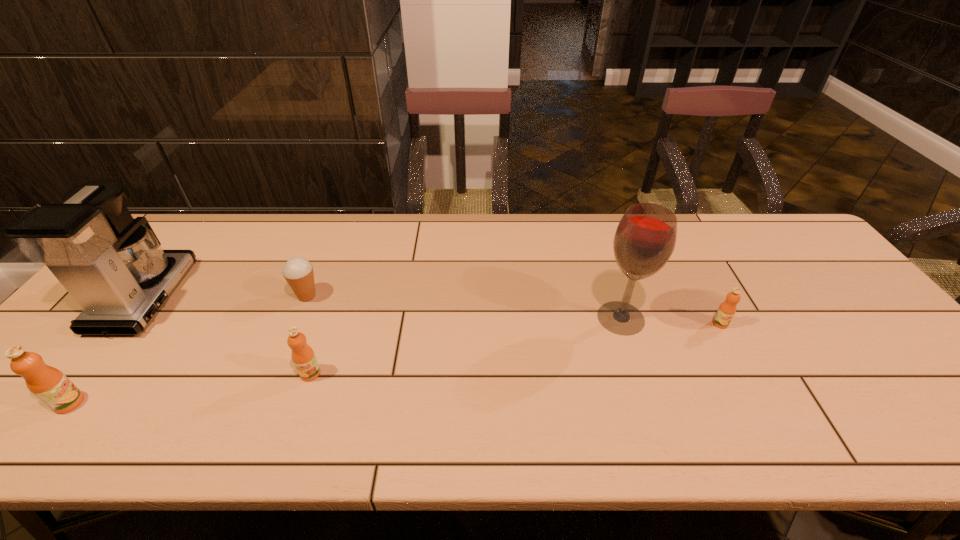
Where is `the nearest object`? Image resolution: width=960 pixels, height=540 pixels. the nearest object is located at coordinates (48, 384).

Where is `the tallest orange juice`? Image resolution: width=960 pixels, height=540 pixels. the tallest orange juice is located at coordinates (48, 384).

The height and width of the screenshot is (540, 960). I want to click on the second farthest orange juice, so click(x=303, y=356).

Image resolution: width=960 pixels, height=540 pixels. In order to click on the second orange juice from right to left in this screenshot , I will do `click(303, 356)`.

At what (x,y) coordinates should I click in order to perform the action: click on the farthest orange juice. Please return your answer as a coordinate pair (x, y). Looking at the image, I should click on (727, 309).

Image resolution: width=960 pixels, height=540 pixels. In order to click on the rightmost object in this screenshot , I will do point(727,309).

You are a GUI agent. You are given a task and a screenshot of the screen. Output one action in this format:
    pyautogui.click(x=<x>, y=<y>)
    Task: Click on the fourth object from right to left
    This screenshot has width=960, height=540.
    Given the screenshot: What is the action you would take?
    pyautogui.click(x=298, y=272)

Find the location of a particular element. The image size is (960, 540). coffee maker is located at coordinates (113, 265).

You are a GUI agent. You are given a task and a screenshot of the screen. Output one action in this format:
    pyautogui.click(x=<x>, y=<y>)
    Task: Click on the alcohol
    Image resolution: width=960 pixels, height=540 pixels.
    Given the screenshot: What is the action you would take?
    pyautogui.click(x=645, y=238)

Locate an element on the screen. vacant space located 0.190m on the front label of the tallest orange juice is located at coordinates (169, 403).